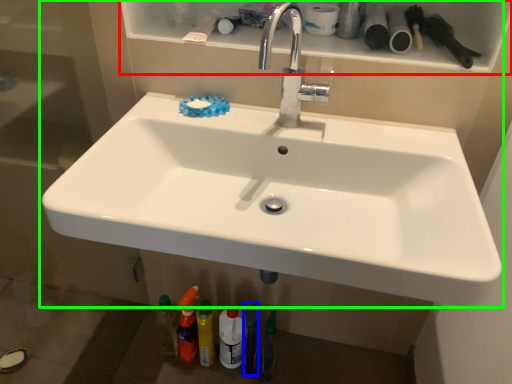
Question: Based on their relative distances, which object is nearer to shelf (highlighted by a red box)? Choose from toiletry (highlighted by a blue box) and sink (highlighted by a green box).

Choices:
 (A) toiletry
 (B) sink

Answer: (B)